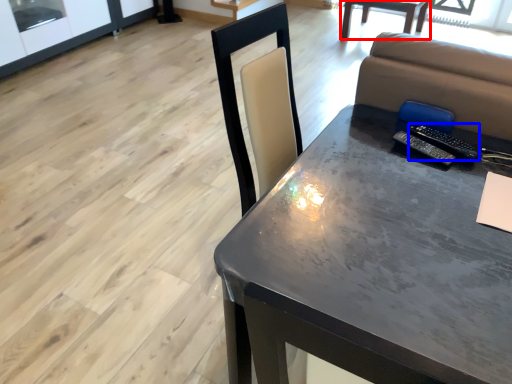
Question: Which object is further to the camera taking this photo, table (highlighted by a red box) or remote (highlighted by a blue box)?

Choices:
 (A) table
 (B) remote

Answer: (A)